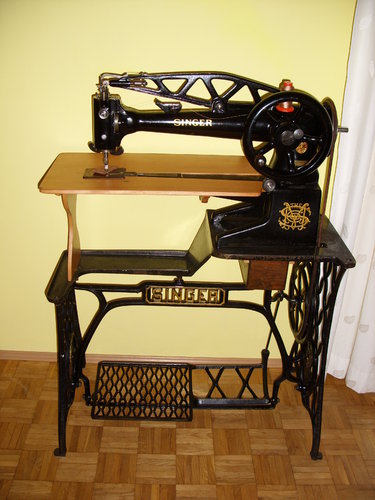
Identify the location of sewing machine. (289, 135).